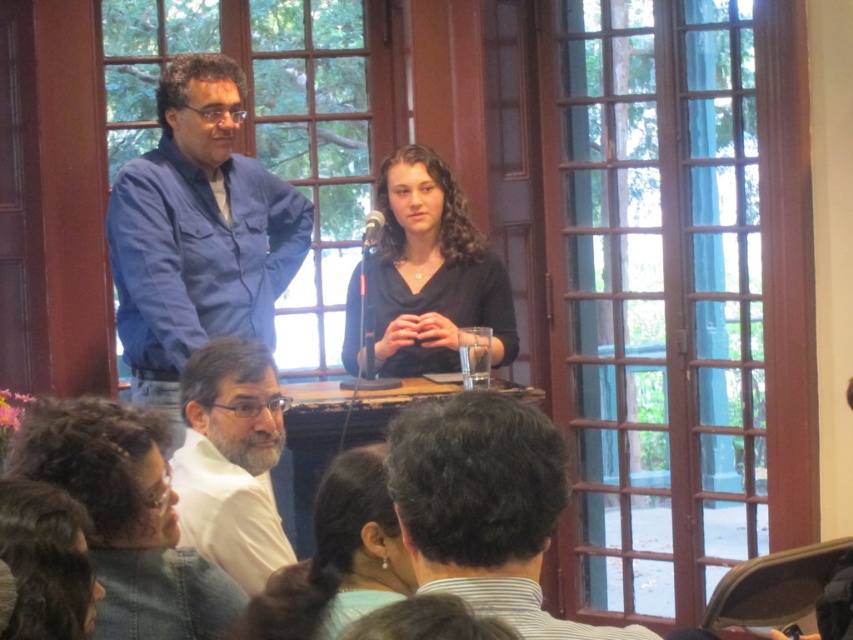
You are standing in the audience and want to see the white matte shirt at lower left located at point (231, 460). Is there any obstruction between you and the point where the white matte shirt at lower left is located?

The white matte shirt at lower left is located at point (231, 460). Since the audience members are seated in the foreground and facing the stage, their heads and shoulders are partially visible, but there is no mention of any obstruction at that specific point. Therefore, it is likely unobstructed.

You are a photographer at the back of the room. You want to take a photo of the blue cotton shirt at upper left and the matte black hair at lower left. Which object should you focus on first if you want to capture both in the same frame without moving the camera?

You should focus on the blue cotton shirt at upper left first because it is taller than the matte black hair at lower left, so it will be more visible in the frame.

You are a photographer at the event and need to capture a clear shot of both the white matte shirt at lower left and the matte black hair at lower center. Based on their positions, which one is positioned higher in the frame?

The white matte shirt at lower left is located above matte black hair at lower center, so it is positioned higher in the frame.